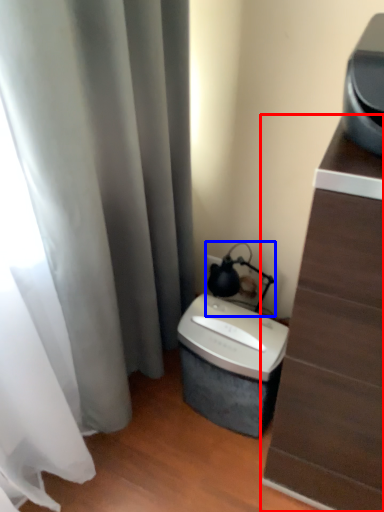
Question: Which object is closer to the camera taking this photo, furniture (highlighted by a red box) or table lamp (highlighted by a blue box)?

Choices:
 (A) furniture
 (B) table lamp

Answer: (A)